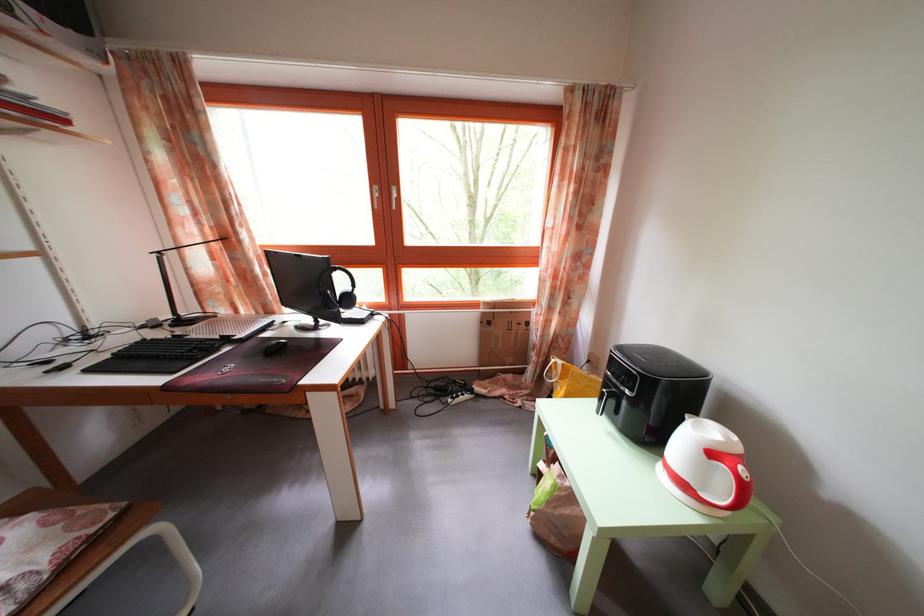
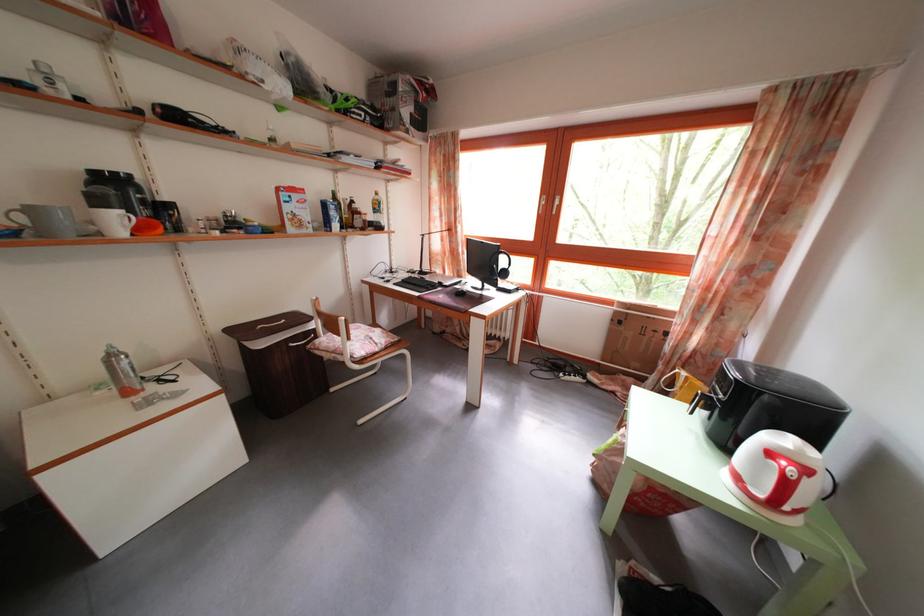
Find the pixel in the second image that matches [491,321] in the first image.

(623, 320)